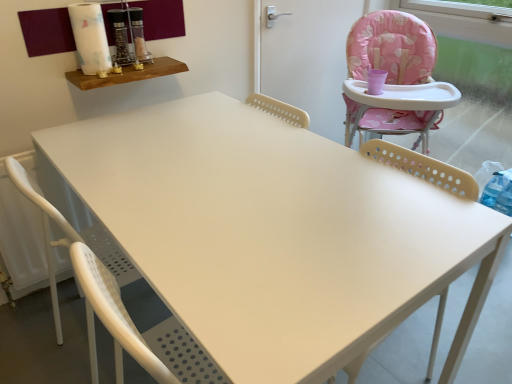
Question: Is white perforated chair at lower left, which is counted as the 1th chair, starting from the left, outside of wooden shelf at upper left?

Choices:
 (A) yes
 (B) no

Answer: (A)

Question: Is white perforated chair at lower left, which is counted as the 1th chair, starting from the left, turned away from wooden shelf at upper left?

Choices:
 (A) no
 (B) yes

Answer: (A)

Question: Can wooden shelf at upper left be found inside white perforated chair at lower left, the 2th chair in the right-to-left sequence?

Choices:
 (A) yes
 (B) no

Answer: (B)

Question: Considering the relative positions of white perforated chair at lower left, the 2th chair in the right-to-left sequence, and wooden shelf at upper left in the image provided, is white perforated chair at lower left, the 2th chair in the right-to-left sequence, to the left of wooden shelf at upper left from the viewer's perspective?

Choices:
 (A) no
 (B) yes

Answer: (A)

Question: Is white perforated chair at lower left, which is counted as the 1th chair, starting from the left, oriented towards wooden shelf at upper left?

Choices:
 (A) yes
 (B) no

Answer: (B)

Question: Considering the positions of point (116, 339) and point (143, 74), is point (116, 339) closer or farther from the camera than point (143, 74)?

Choices:
 (A) farther
 (B) closer

Answer: (B)

Question: Is white perforated chair at lower left, which is counted as the 1th chair, starting from the left, in front of or behind wooden shelf at upper left in the image?

Choices:
 (A) front
 (B) behind

Answer: (A)

Question: Considering the positions of white perforated chair at lower left, the 2th chair in the right-to-left sequence, and wooden shelf at upper left in the image, is white perforated chair at lower left, the 2th chair in the right-to-left sequence, bigger or smaller than wooden shelf at upper left?

Choices:
 (A) small
 (B) big

Answer: (B)

Question: In terms of height, does white perforated chair at lower left, which is counted as the 1th chair, starting from the left, look taller or shorter compared to wooden shelf at upper left?

Choices:
 (A) tall
 (B) short

Answer: (A)

Question: Is wooden shelf at upper left bigger or smaller than white perforated chair at lower left, the 2th chair in the right-to-left sequence?

Choices:
 (A) small
 (B) big

Answer: (A)

Question: In terms of height, does wooden shelf at upper left look taller or shorter compared to white perforated chair at lower left, the 2th chair in the right-to-left sequence?

Choices:
 (A) short
 (B) tall

Answer: (A)

Question: Visually, is wooden shelf at upper left positioned to the left or to the right of white perforated chair at lower left, the 2th chair in the right-to-left sequence?

Choices:
 (A) right
 (B) left

Answer: (B)

Question: Is wooden shelf at upper left wider or thinner than white perforated chair at lower left, which is counted as the 1th chair, starting from the left?

Choices:
 (A) wide
 (B) thin

Answer: (B)

Question: Is wooden shelf at upper left in front of or behind pink fabric screen door at upper right in the image?

Choices:
 (A) front
 (B) behind

Answer: (A)

Question: Does point (176, 61) appear closer or farther from the camera than point (282, 86)?

Choices:
 (A) closer
 (B) farther

Answer: (A)